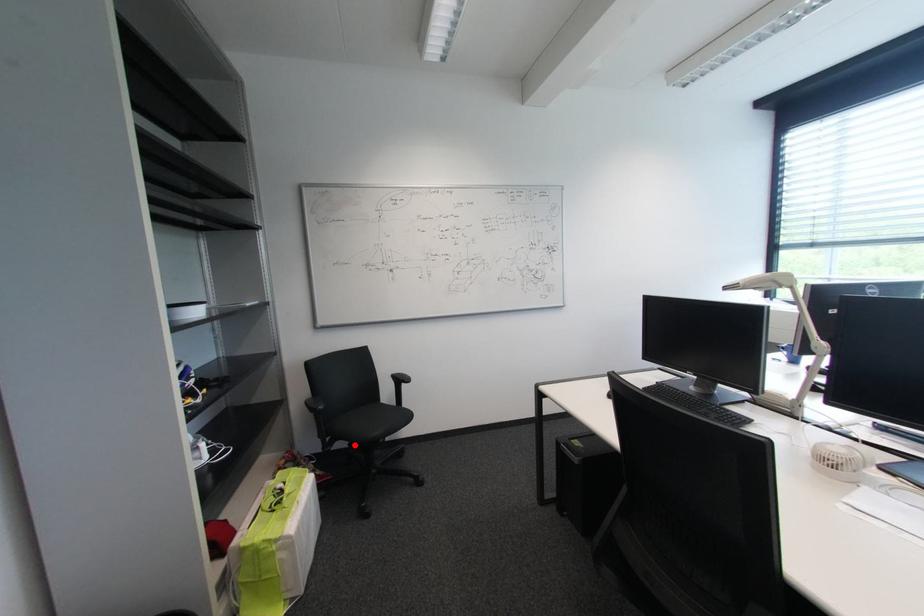
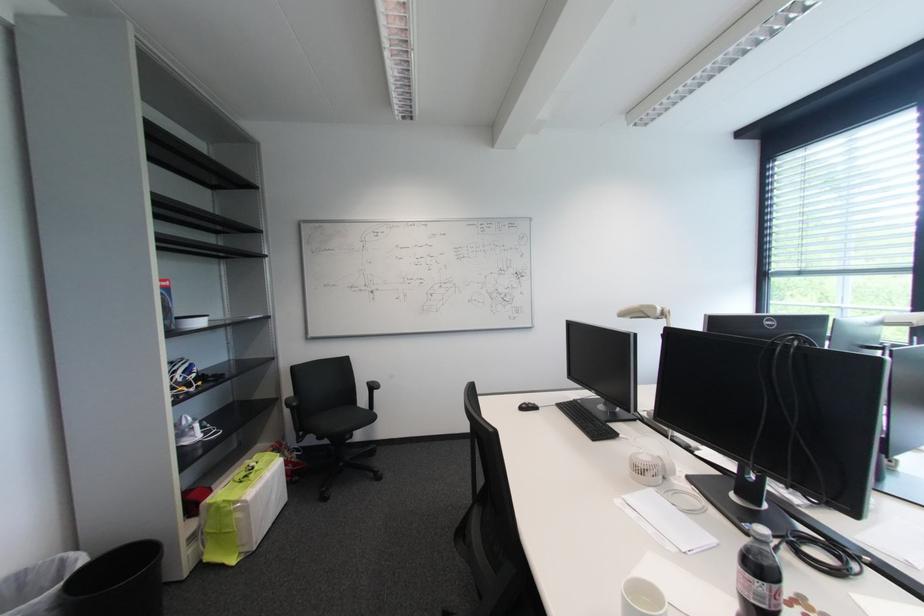
Question: A red point is marked in image1. In image2, is the corresponding 3D point closer to the camera or farther? Reply with the corresponding letter.

Choices:
 (A) The corresponding 3D point is closer.
 (B) The corresponding 3D point is farther.

Answer: (B)